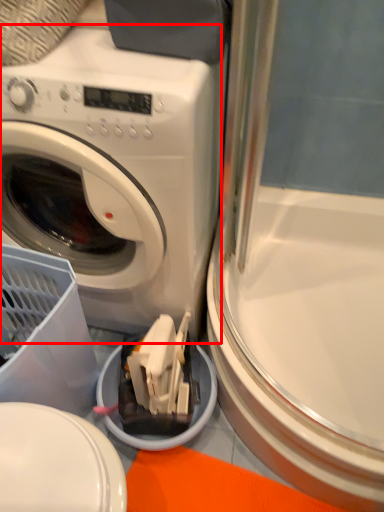
Question: Observing the image, what is the correct spatial positioning of washing machine (annotated by the red box) in reference to screen door?

Choices:
 (A) left
 (B) right

Answer: (A)